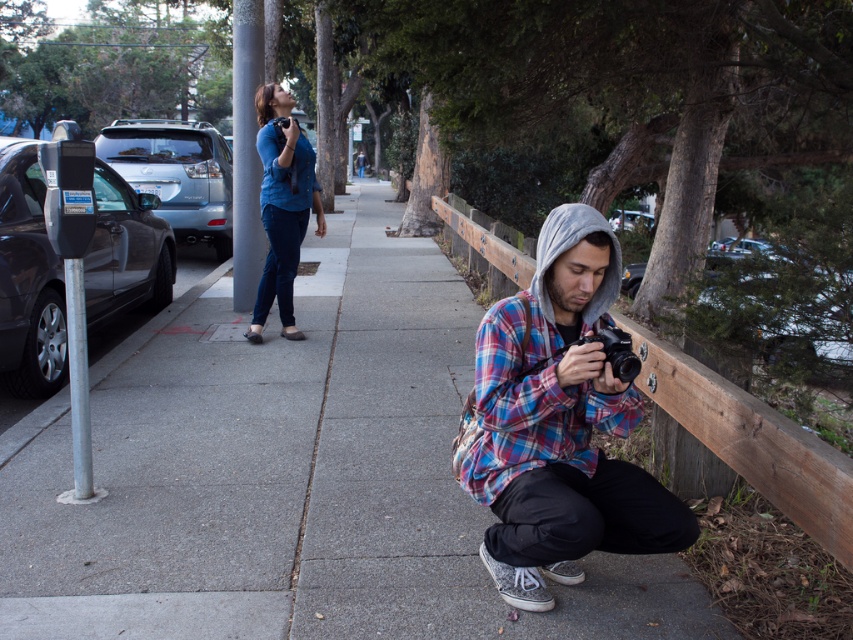
You are a photographer trying to capture a wide shot of the gray concrete pavement at center and the matte blue shirt at center in the scene. Based on their relative widths, which object should you frame first to ensure both fit in the shot?

The gray concrete pavement at center is wider than the matte blue shirt at center, so you should frame the gray concrete pavement at center first to ensure both fit in the shot.

You are a photographer trying to capture the entire scene of the gray concrete pavement at center and the plaid flannel shirt at center in one shot. Given that your camera has a limited field of view, which object should you focus on to ensure both are fully visible?

The gray concrete pavement at center is bigger than the plaid flannel shirt at center, so focusing on the larger object, the gray concrete pavement at center, will ensure both are fully visible within the camera frame.

You are standing at the point labeled point (103, 532) and want to walk to the point labeled point (315, 230). Which direction should you face to move towards your destination?

You should face away from the camera because point (315, 230) is further from the camera than point (103, 532).